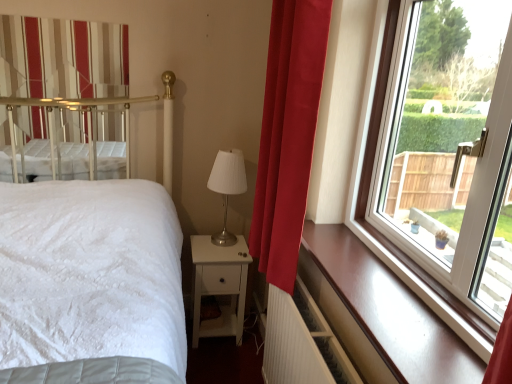
Question: From a real-world perspective, is glossy wood window sill at right physically below transparent glass window at right?

Choices:
 (A) yes
 (B) no

Answer: (A)

Question: Is glossy wood window sill at right outside transparent glass window at right?

Choices:
 (A) no
 (B) yes

Answer: (B)

Question: Can you confirm if glossy wood window sill at right is thinner than transparent glass window at right?

Choices:
 (A) yes
 (B) no

Answer: (B)

Question: Is glossy wood window sill at right smaller than transparent glass window at right?

Choices:
 (A) yes
 (B) no

Answer: (A)

Question: From the image's perspective, is glossy wood window sill at right located beneath transparent glass window at right?

Choices:
 (A) yes
 (B) no

Answer: (A)

Question: Can you confirm if glossy wood window sill at right is positioned to the left of transparent glass window at right?

Choices:
 (A) yes
 (B) no

Answer: (A)

Question: Is velvet red curtain at right, which is the 2th curtain from back to front, at the left side of transparent glass window at right?

Choices:
 (A) yes
 (B) no

Answer: (A)

Question: From the image's perspective, is velvet red curtain at right, which is the 2th curtain from left to right, over transparent glass window at right?

Choices:
 (A) yes
 (B) no

Answer: (A)

Question: Can you confirm if velvet red curtain at right, which is the 2th curtain from back to front, is shorter than transparent glass window at right?

Choices:
 (A) yes
 (B) no

Answer: (B)

Question: Can you confirm if velvet red curtain at right, the first curtain when ordered from front to back, is thinner than transparent glass window at right?

Choices:
 (A) yes
 (B) no

Answer: (B)

Question: Does velvet red curtain at right, which is the 2th curtain from back to front, lie behind transparent glass window at right?

Choices:
 (A) no
 (B) yes

Answer: (B)

Question: Could you tell me if velvet red curtain at right, the first curtain when ordered from front to back, is facing transparent glass window at right?

Choices:
 (A) no
 (B) yes

Answer: (A)

Question: Is white ribbed radiator at lower right thinner than glossy wood window sill at right?

Choices:
 (A) no
 (B) yes

Answer: (B)